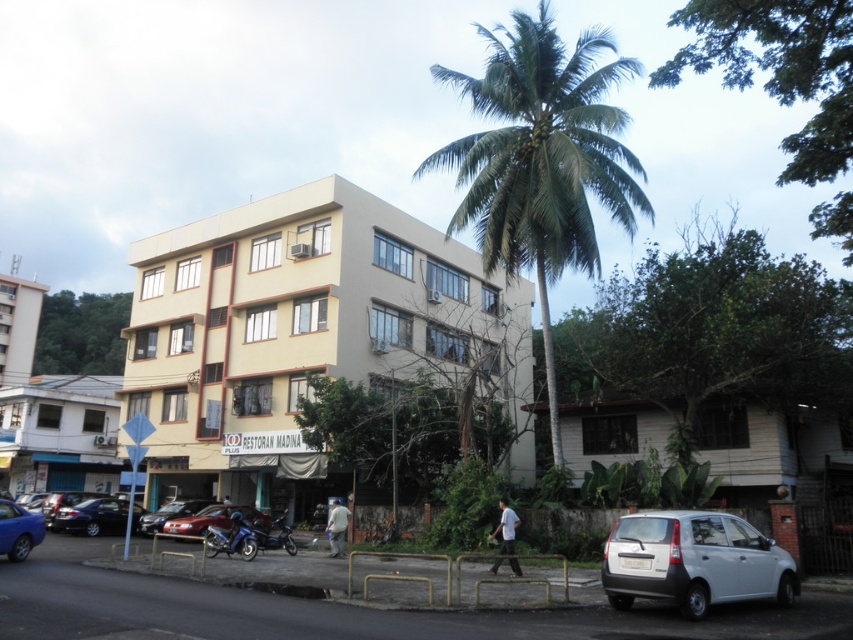
You are standing at the point with coordinates point (169, 513). Looking around, you see a shiny red car at lower left. Which direction should you walk to reach the silver car on the right side of the frame?

The point (169, 513) corresponds to the shiny red car at lower left. To reach the silver car on the right side of the frame, you should walk towards the right.

You are a delivery person who needs to park your 2.5 meter long van between the shiny red car at lower left and the shiny blue motorcycle at center. Is there enough space between them to fit your van?

The distance between the shiny red car at lower left and the shiny blue motorcycle at center is 4.75 meters. Since your van is 2.5 meters long, there is sufficient space as 4.75 meters is greater than 2.5 meters.

You are a delivery person trying to park your blue metallic motorcycle at lower left near the beige concrete building at center. Is there enough space between the motorcycle and the building to fit a small package box that is 1 meter wide?

The beige concrete building at center might be wider than blue metallic motorcycle at lower left, but without specific measurements of the space between them, it is uncertain if the 1 meter wide package box will fit. Check the available space physically before attempting to park.